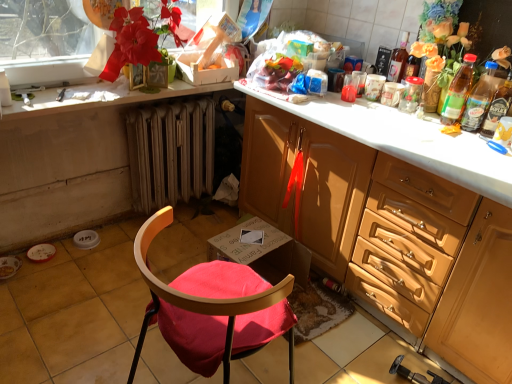
Where is `free spot above metallic radiator at lower center (from a real-world perspective)`? free spot above metallic radiator at lower center (from a real-world perspective) is located at coordinates (172, 105).